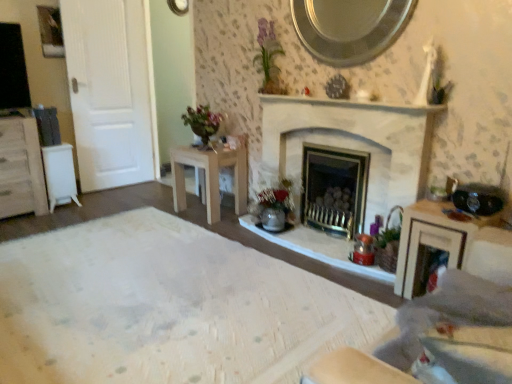
Question: In the image, is white matte door at left positioned in front of or behind white plastic table at left, the second table viewed from the right?

Choices:
 (A) behind
 (B) front

Answer: (A)

Question: Considering the positions of point (114, 130) and point (48, 183), is point (114, 130) closer or farther from the camera than point (48, 183)?

Choices:
 (A) closer
 (B) farther

Answer: (B)

Question: Estimate the real-world distances between objects in this image. Which object is farther from the white wood cabinet at left?

Choices:
 (A) light wood table at center, the second table positioned from the left
 (B) silver metallic mirror at upper center
 (C) wooden vanity at right
 (D) white stone fireplace at center
 (E) white stone fireplace at center

Answer: (C)

Question: Which is nearer to the wooden vanity at right?

Choices:
 (A) white matte door at left
 (B) white stone fireplace at center
 (C) white wood cabinet at left
 (D) silver metallic mirror at upper center
 (E) white stone fireplace at center

Answer: (E)